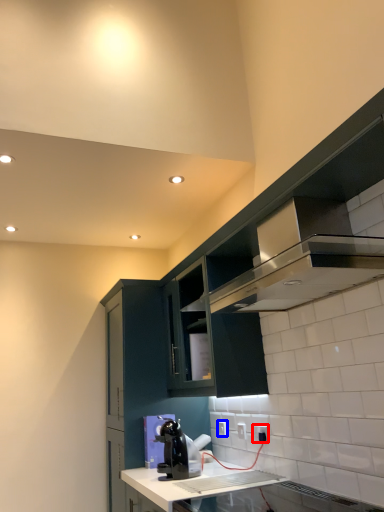
Question: Which point is closer to the camera, electric outlet (highlighted by a red box) or electric outlet (highlighted by a blue box)?

Choices:
 (A) electric outlet
 (B) electric outlet

Answer: (A)